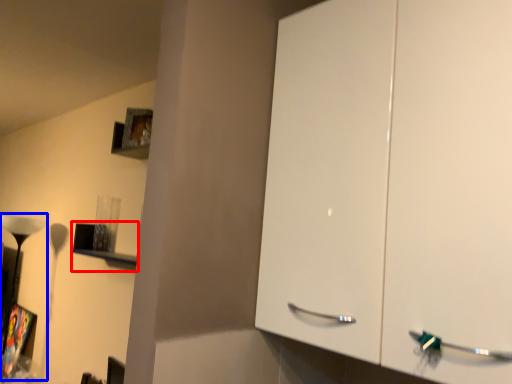
Question: Which point is closer to the camera, shelf (highlighted by a red box) or lamp (highlighted by a blue box)?

Choices:
 (A) shelf
 (B) lamp

Answer: (A)